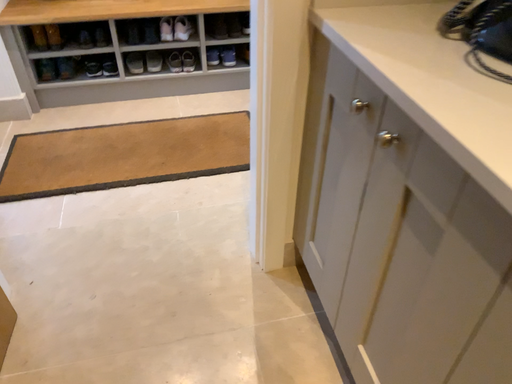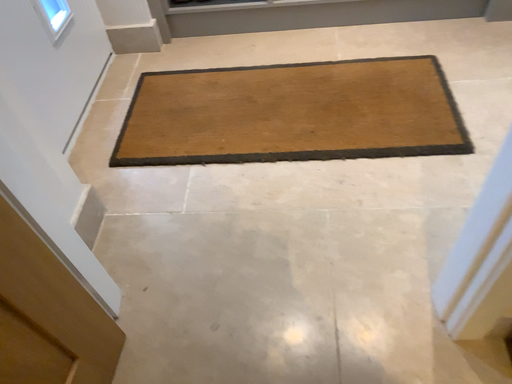
Question: How did the camera likely rotate when shooting the video?

Choices:
 (A) rotated left
 (B) rotated right

Answer: (A)